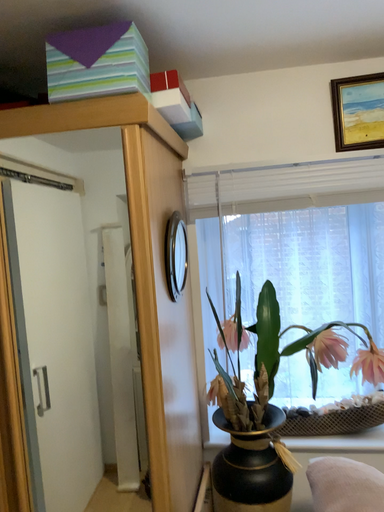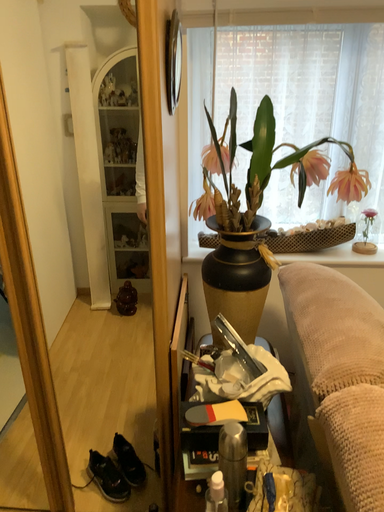
Question: Which way did the camera rotate in the video?

Choices:
 (A) rotated left
 (B) rotated right

Answer: (B)